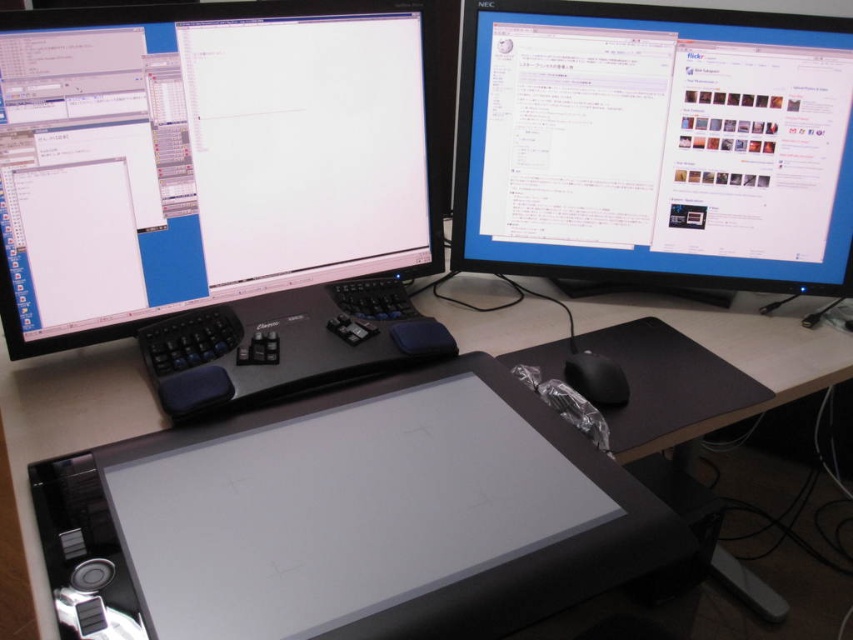
Does matte black monitor at upper left have a greater width compared to matte black monitor at upper right?

In fact, matte black monitor at upper left might be narrower than matte black monitor at upper right.

The width and height of the screenshot is (853, 640). What do you see at coordinates (207, 157) in the screenshot?
I see `matte black monitor at upper left` at bounding box center [207, 157].

This screenshot has width=853, height=640. Find the location of `matte black monitor at upper left`. matte black monitor at upper left is located at coordinates (207, 157).

Looking at this image, measure the distance between matte black monitor at upper right and camera.

matte black monitor at upper right and camera are 3.83 feet apart.

Is matte black monitor at upper right bigger than black plastic computer desk at center?

Actually, matte black monitor at upper right might be smaller than black plastic computer desk at center.

Between point (584, 211) and point (105, 408), which one is positioned in front?

Point (105, 408) is in front.

Identify the location of matte black monitor at upper right. The height and width of the screenshot is (640, 853). (654, 145).

Between matte black monitor at upper left and black matte keyboard at center, which one is positioned lower?

Positioned lower is black matte keyboard at center.

The image size is (853, 640). Describe the element at coordinates (207, 157) in the screenshot. I see `matte black monitor at upper left` at that location.

Find the location of `matte black monitor at upper left`. matte black monitor at upper left is located at coordinates (207, 157).